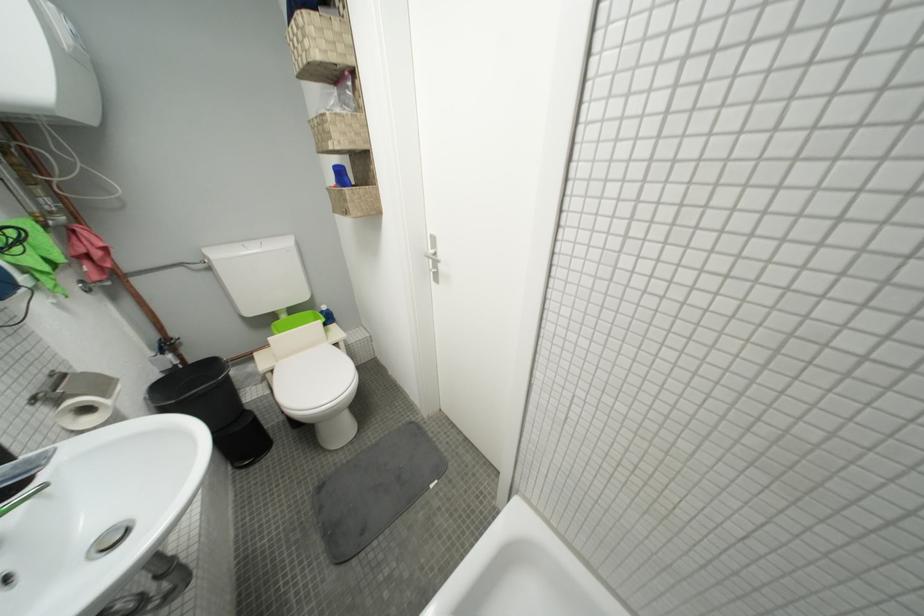
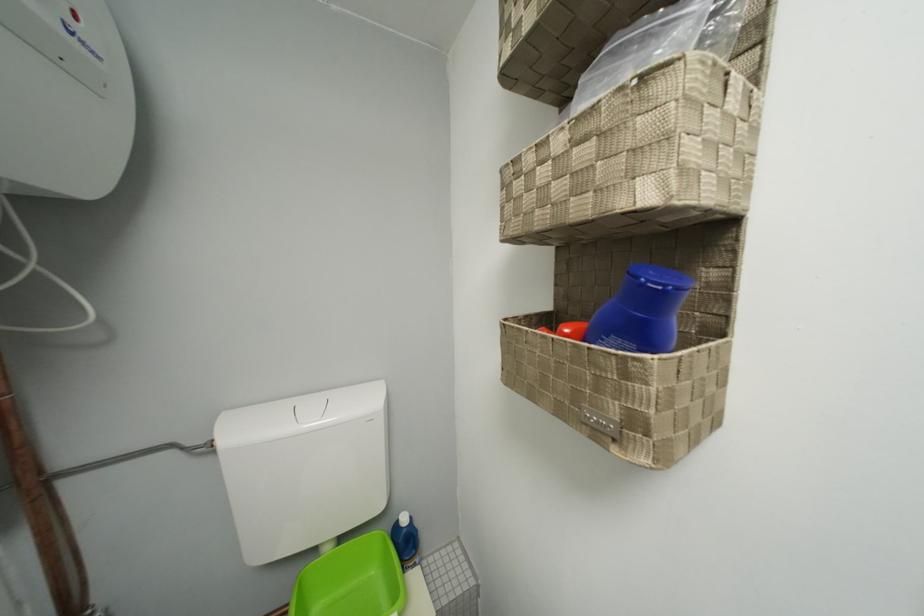
Find the pixel in the second image that matches the point at 293,318 in the first image.

(335, 552)